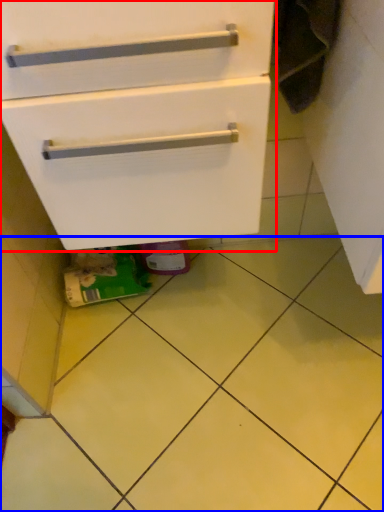
Question: Which object appears closest to the camera in this image, cabinetry (highlighted by a red box) or ceramic tile (highlighted by a blue box)?

Choices:
 (A) cabinetry
 (B) ceramic tile

Answer: (A)